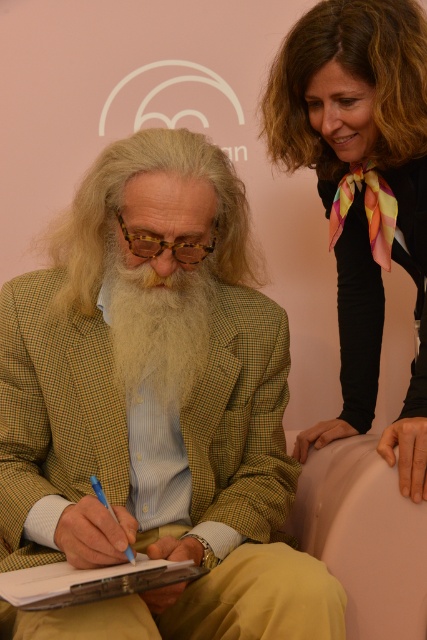
Question: Among these objects, which one is nearest to the camera?

Choices:
 (A) smooth beige armchair at lower center
 (B) blue plastic pen at lower left
 (C) green checkered suit at center
 (D) matte paper clipboard at lower left

Answer: (D)

Question: Does smooth beige armchair at lower center have a greater width compared to golden textured beard at center?

Choices:
 (A) yes
 (B) no

Answer: (A)

Question: Is smooth beige armchair at lower center smaller than blue plastic pen at lower left?

Choices:
 (A) no
 (B) yes

Answer: (A)

Question: Can you confirm if green checkered suit at center is positioned to the right of smooth beige armchair at lower center?

Choices:
 (A) no
 (B) yes

Answer: (A)

Question: Among these points, which one is nearest to the camera?

Choices:
 (A) (163, 380)
 (B) (315, 524)

Answer: (A)

Question: Which of the following is the farthest from the observer?

Choices:
 (A) (304, 163)
 (B) (99, 497)
 (C) (167, 592)
 (D) (315, 552)

Answer: (A)